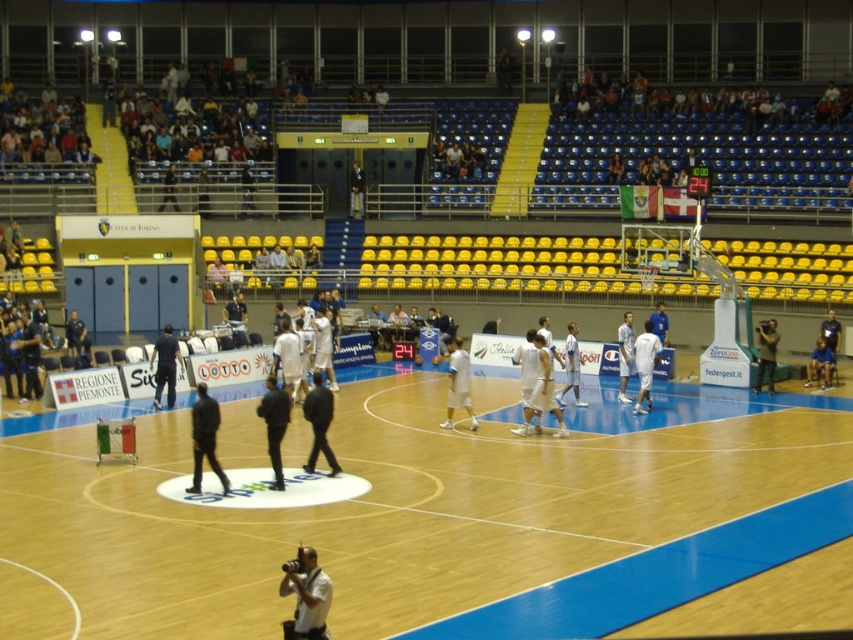
Question: Is dark blue jacket at center smaller than dark gray jacket at center?

Choices:
 (A) yes
 (B) no

Answer: (A)

Question: Is black matte jacket at center positioned at the back of dark gray jacket at center?

Choices:
 (A) yes
 (B) no

Answer: (B)

Question: Can you confirm if wooden at center is positioned to the left of dark blue jacket at center?

Choices:
 (A) yes
 (B) no

Answer: (B)

Question: Which object appears closest to the camera in this image?

Choices:
 (A) dark blue jacket at center
 (B) black matte jacket at center
 (C) white jersey at center
 (D) white matte camera at lower center

Answer: (D)

Question: Which point is farther to the camera?

Choices:
 (A) (769, 346)
 (B) (312, 445)
 (C) (310, 588)
 (D) (569, 378)

Answer: (A)

Question: Estimate the real-world distances between objects in this image. Which object is closer to the white matte basketball player at center?

Choices:
 (A) black matte jacket at center
 (B) white matte camera at lower center

Answer: (A)